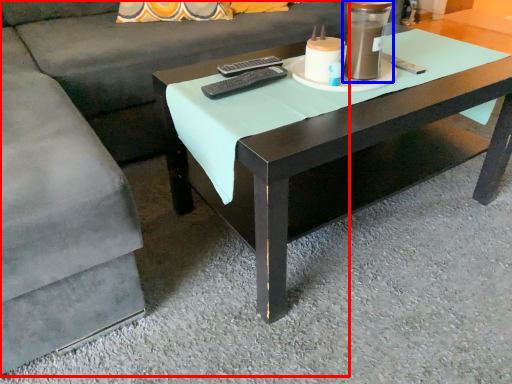
Question: Which of the following is the farthest to the observer, couch (highlighted by a red box) or candle holder (highlighted by a blue box)?

Choices:
 (A) couch
 (B) candle holder

Answer: (B)